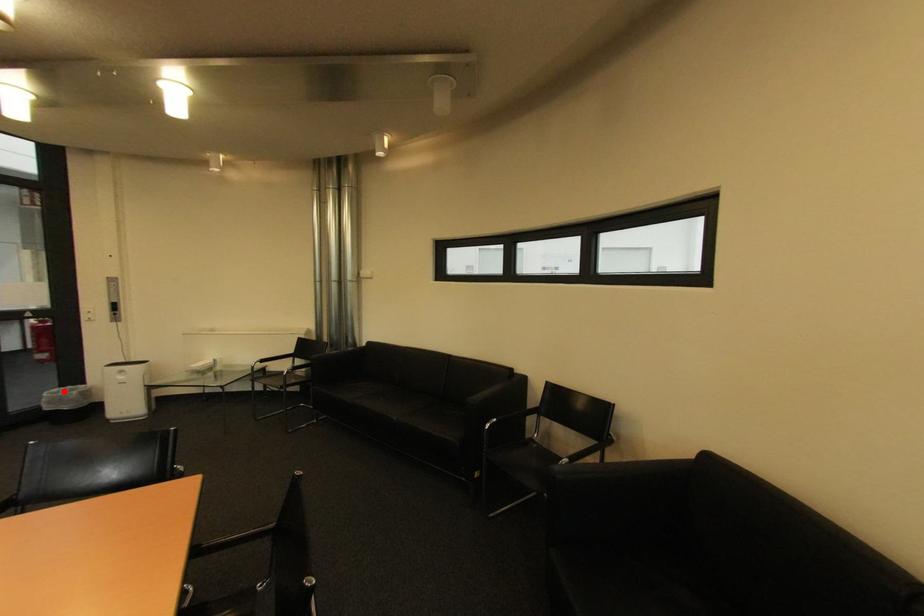
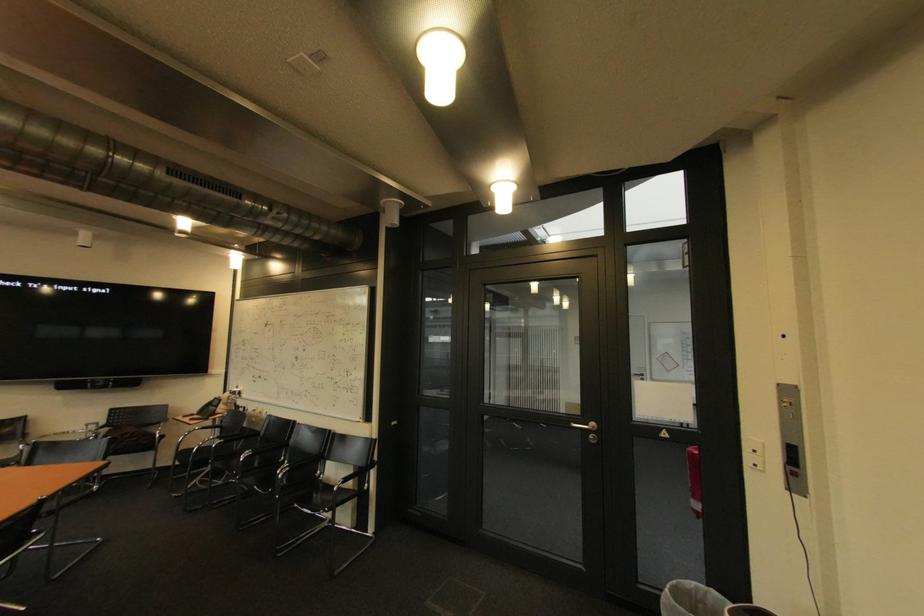
Question: I am providing you with two images of the same scene from different viewpoints. Given a red point in image1, look at the same physical point in image2. Is it:

Choices:
 (A) Closer to the viewpoint
 (B) Farther from the viewpoint

Answer: (B)